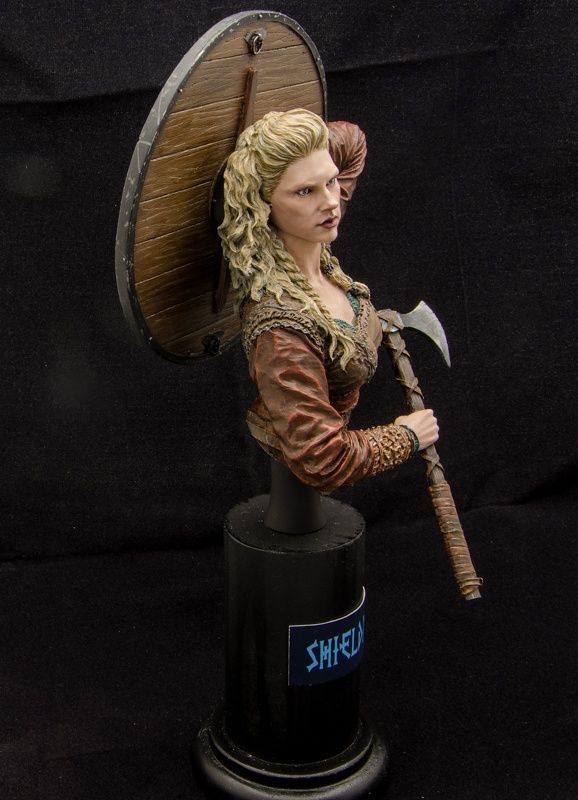
The image size is (578, 800). I want to click on name plate, so click(320, 637).